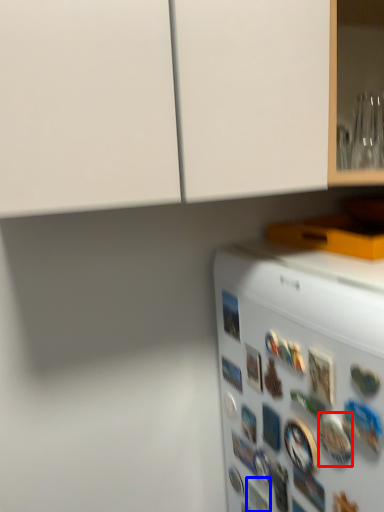
Question: Which point is further to the camera, button (highlighted by a red box) or button (highlighted by a blue box)?

Choices:
 (A) button
 (B) button

Answer: (B)